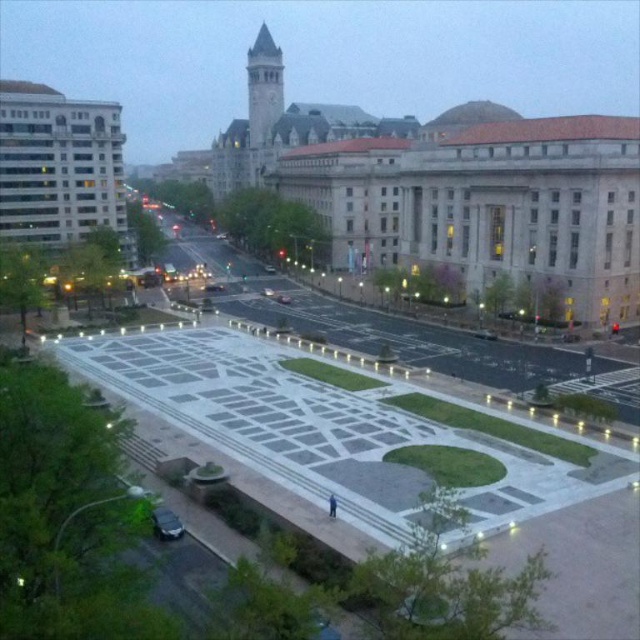
Question: From the image, what is the correct spatial relationship of gray stone clock tower at upper center in relation to shiny black sedan at lower left?

Choices:
 (A) left
 (B) right

Answer: (A)

Question: Which point is closer to the camera?

Choices:
 (A) gray stone clock tower at upper center
 (B) shiny black sedan at lower left

Answer: (B)

Question: Can you confirm if gray stone clock tower at upper center is positioned to the right of shiny black sedan at lower left?

Choices:
 (A) yes
 (B) no

Answer: (B)

Question: Can you confirm if gray stone clock tower at upper center is positioned above shiny black sedan at lower left?

Choices:
 (A) yes
 (B) no

Answer: (A)